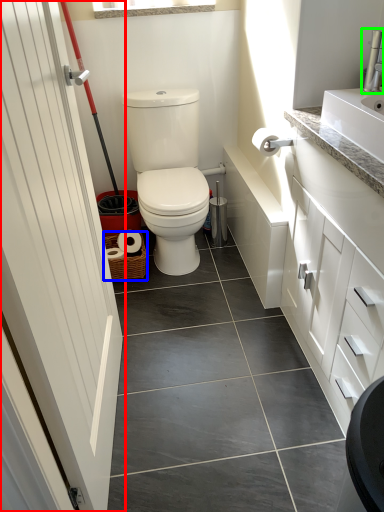
Question: Which is farther away from door (highlighted by a red box)? basket (highlighted by a blue box) or faucet (highlighted by a green box)?

Choices:
 (A) basket
 (B) faucet

Answer: (B)